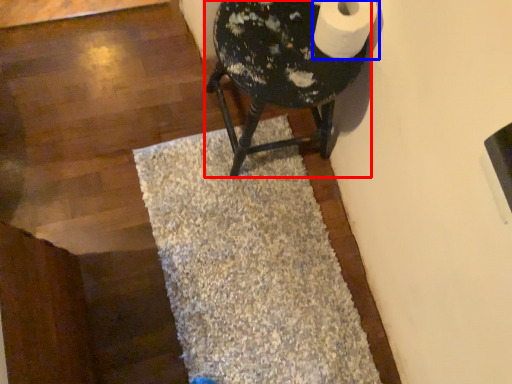
Question: Which object is further to the camera taking this photo, furniture (highlighted by a red box) or toilet paper (highlighted by a blue box)?

Choices:
 (A) furniture
 (B) toilet paper

Answer: (A)